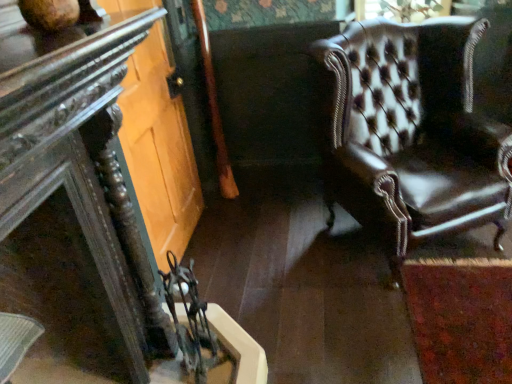
This screenshot has height=384, width=512. In order to click on vacant space situated on the left part of leather armchair at right in this screenshot , I will do `click(278, 256)`.